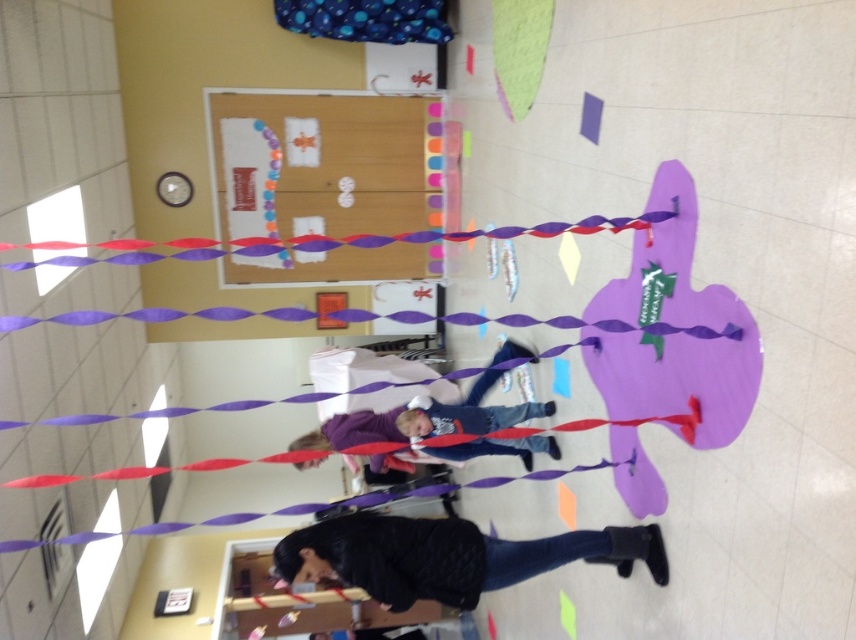
Who is positioned more to the right, matte cardboard bulletin board at upper center or black textured jacket at lower center?

Positioned to the right is black textured jacket at lower center.

This screenshot has height=640, width=856. Describe the element at coordinates (324, 163) in the screenshot. I see `matte cardboard bulletin board at upper center` at that location.

I want to click on matte cardboard bulletin board at upper center, so click(x=324, y=163).